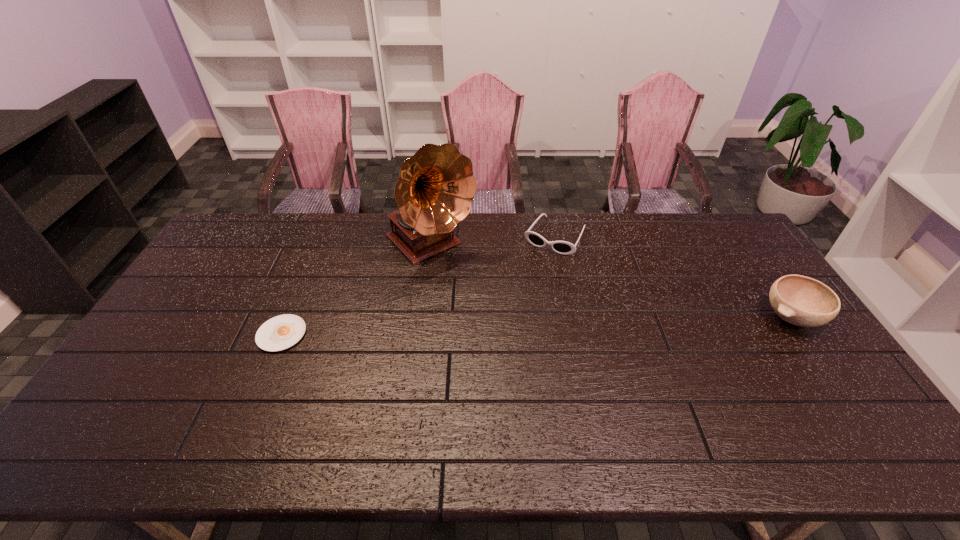
Locate an element on the screen. the shortest object is located at coordinates (281, 332).

This screenshot has width=960, height=540. I want to click on egg yolk, so click(x=281, y=332).

Locate an element on the screen. The width and height of the screenshot is (960, 540). the second tallest object is located at coordinates (802, 301).

Where is `the rightmost object`? This screenshot has width=960, height=540. the rightmost object is located at coordinates (802, 301).

Locate an element on the screen. the second object from right to left is located at coordinates (562, 247).

Find the location of a particular element. This screenshot has height=540, width=960. sunglasses is located at coordinates (562, 247).

The width and height of the screenshot is (960, 540). I want to click on the tallest object, so click(x=436, y=186).

The height and width of the screenshot is (540, 960). I want to click on the third object from right to left, so click(x=436, y=186).

The height and width of the screenshot is (540, 960). Identify the location of free space located on the left of the leftmost object. point(209,334).

The height and width of the screenshot is (540, 960). Find the location of `free region located on the front of the bowl`. free region located on the front of the bowl is located at coordinates (856, 413).